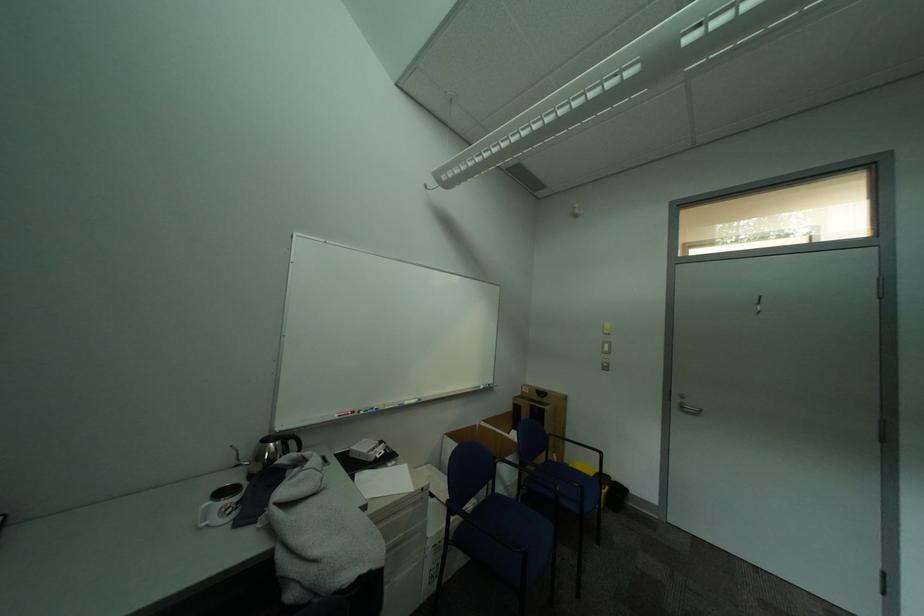
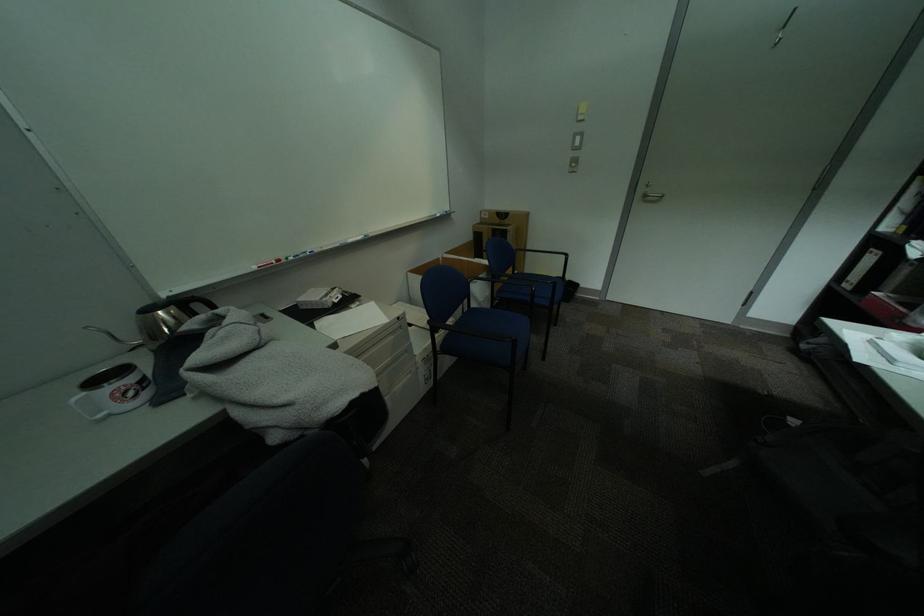
Where in the second image is the point corresponding to point 691,408 from the first image?

(655, 197)